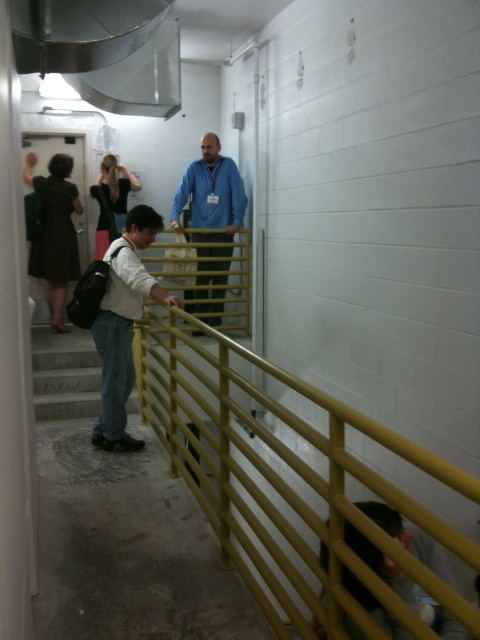
Question: Is blue fabric shirt at center further to camera compared to brown fabric dress at upper left?

Choices:
 (A) yes
 (B) no

Answer: (B)

Question: Which point is closer to the camera?

Choices:
 (A) denim jeans at center
 (B) yellow matte rail at center
 (C) blue fabric shirt at center
 (D) brown fabric dress at upper left

Answer: (B)

Question: Is yellow matte rail at center thinner than brown fabric dress at upper left?

Choices:
 (A) yes
 (B) no

Answer: (B)

Question: Observing the image, what is the correct spatial positioning of denim jeans at center in reference to blue fabric shirt at center?

Choices:
 (A) above
 (B) below

Answer: (B)

Question: Among these points, which one is nearest to the camera?

Choices:
 (A) (52, 257)
 (B) (229, 220)

Answer: (B)

Question: Which object appears farthest from the camera in this image?

Choices:
 (A) blue fabric shirt at center
 (B) denim jeans at center
 (C) brown fabric dress at upper left

Answer: (C)